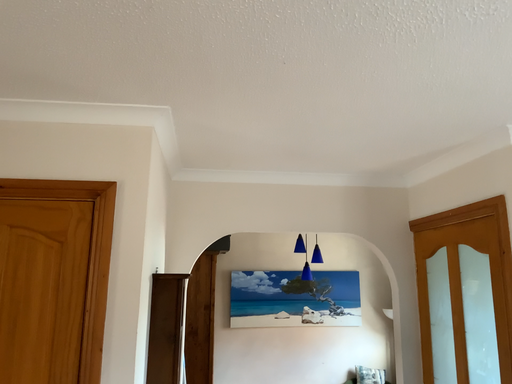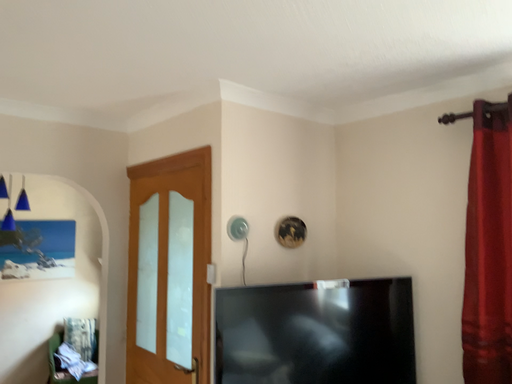
Question: How did the camera likely rotate when shooting the video?

Choices:
 (A) rotated downward
 (B) rotated upward

Answer: (A)